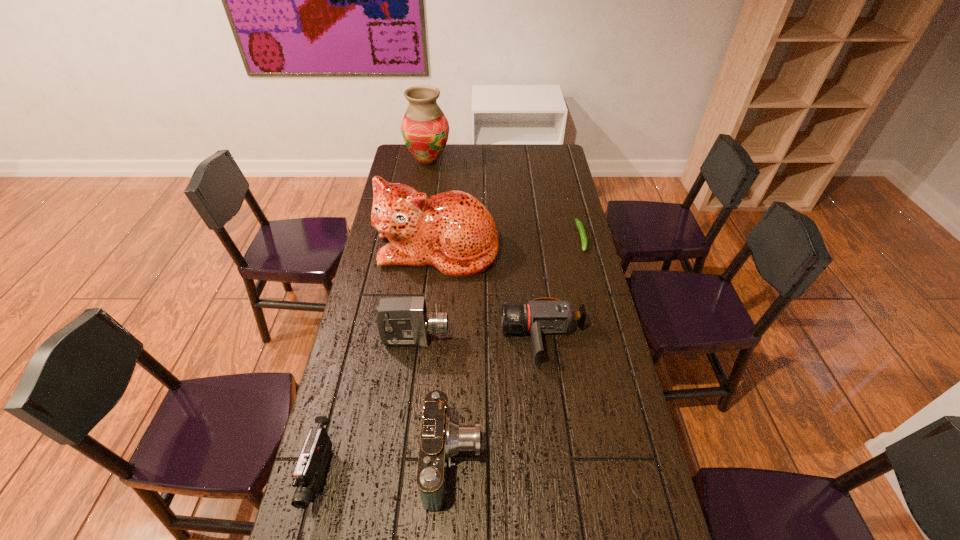
The height and width of the screenshot is (540, 960). Identify the location of zucchini that is at the right edge. (579, 224).

This screenshot has width=960, height=540. Find the location of `object present at the far left corner`. object present at the far left corner is located at coordinates (425, 129).

Where is `vacant space at the far edge`? The height and width of the screenshot is (540, 960). vacant space at the far edge is located at coordinates (522, 145).

In the image, there is a desktop. Where is `vacant space at the left edge`? vacant space at the left edge is located at coordinates (388, 362).

Identify the location of blank space at the right edge of the desktop. The width and height of the screenshot is (960, 540). (544, 226).

You are a GUI agent. You are given a task and a screenshot of the screen. Output one action in this format:
    pyautogui.click(x=<x>, y=<y>)
    Task: Click on the vacant area that lies between the shortest object and the second shortest camcorder
    Image resolution: width=960 pixels, height=540 pixels.
    Given the screenshot: What is the action you would take?
    pyautogui.click(x=451, y=356)

Identify the location of vacant space in between the sixth tallest object and the cat. (491, 294).

Locate an element on the screen. vacant point located between the zucchini and the farthest object is located at coordinates (505, 199).

This screenshot has width=960, height=540. I want to click on blank region between the shortest object and the shortest camcorder, so click(563, 287).

Find the location of a particular element. This screenshot has width=960, height=540. free point between the third shortest object and the shortest object is located at coordinates (451, 356).